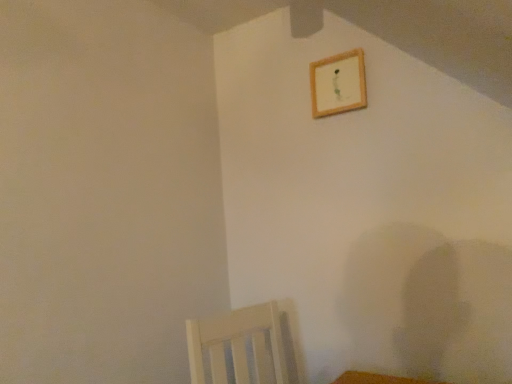
At what (x,y) coordinates should I click in order to perform the action: click on wooden frame at upper center. Please return your answer as a coordinate pair (x, y). Looking at the image, I should click on (338, 84).

The image size is (512, 384). Describe the element at coordinates (338, 84) in the screenshot. I see `wooden frame at upper center` at that location.

In order to face wooden frame at upper center, should I rotate leftwards or rightwards?

Turn right approximately 10.808 degrees to face it.

Locate an element on the screen. This screenshot has height=384, width=512. wooden frame at upper center is located at coordinates (338, 84).